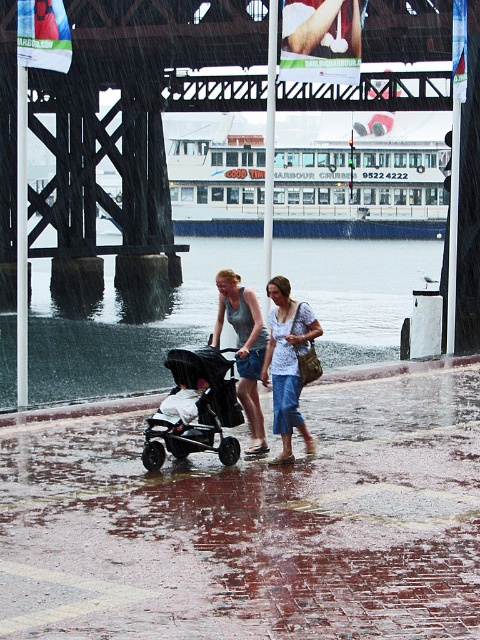
Question: Does wet brick pavement at center appear under shiny black stroller at center?

Choices:
 (A) no
 (B) yes

Answer: (B)

Question: Is denim pants at center thinner than matte black stroller at center?

Choices:
 (A) no
 (B) yes

Answer: (B)

Question: Among these objects, which one is farthest from the camera?

Choices:
 (A) metallic pole at left
 (B) soft gray fabric stroller at center
 (C) denim pants at center

Answer: (A)

Question: Does shiny black stroller at center appear under black matte stroller at center?

Choices:
 (A) yes
 (B) no

Answer: (B)

Question: Which of the following is the farthest from the observer?

Choices:
 (A) (405, 467)
 (B) (192, 305)
 (C) (294, 342)
 (D) (226, 417)

Answer: (B)

Question: Among these objects, which one is nearest to the camera?

Choices:
 (A) black matte stroller at center
 (B) shiny black stroller at center
 (C) matte black stroller at center

Answer: (A)